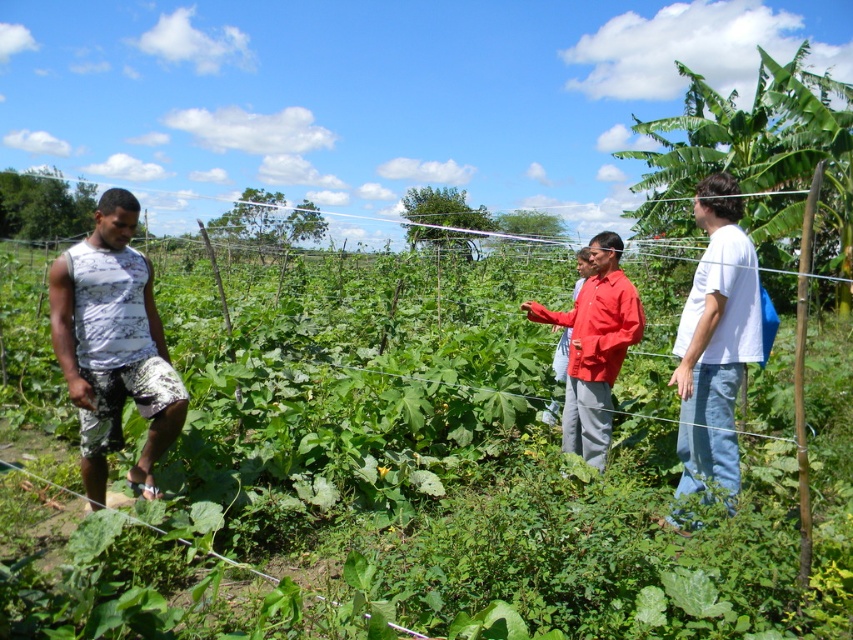
You are a photographer trying to capture both the white printed tank top at left and the white cotton shirt at right in the same frame. Based on their positions, which clothing item is closer to the camera?

The white printed tank top at left is closer to the camera because it is positioned under the white cotton shirt at right, indicating it is in front.

You are standing in the agricultural field and want to walk from the point at coordinates point (254, 554) to the point at coordinates point (624, 328). Based on the scene description, which direction should you walk to move from the first point to the second point?

You should walk backward or in the direction away from the foreground because point (254, 554) is in front of point (624, 328), meaning the second point is behind the first one.